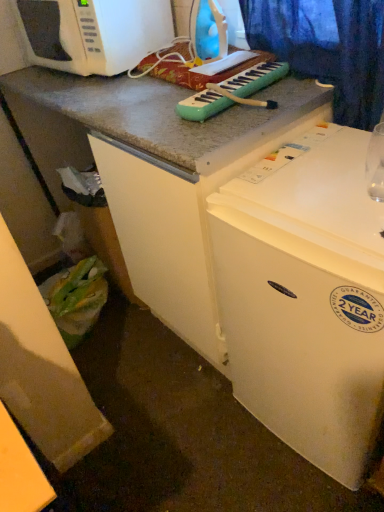
The image size is (384, 512). Find the location of `vacant space positioned to the left of transparent glass at upper right`. vacant space positioned to the left of transparent glass at upper right is located at coordinates (312, 200).